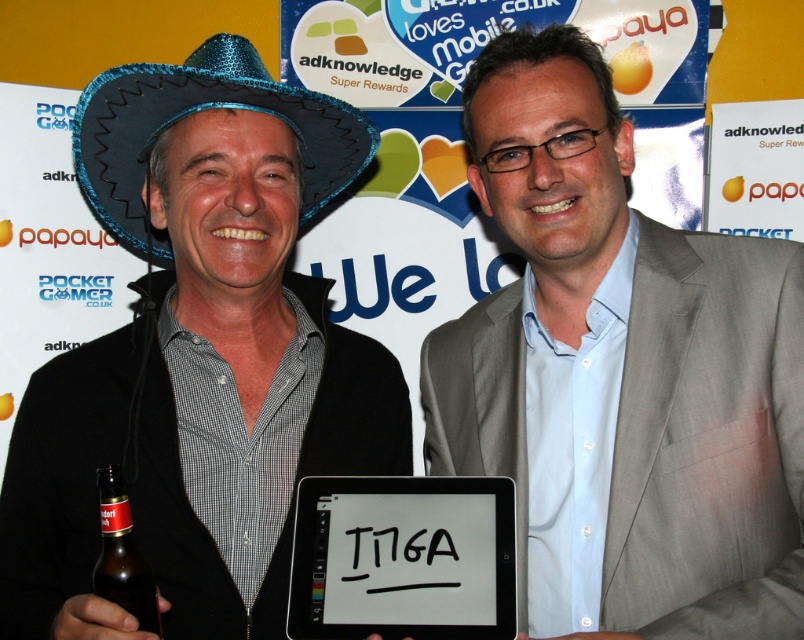
Question: Can you confirm if light gray suit at center is positioned to the right of black matte tablet at center?

Choices:
 (A) yes
 (B) no

Answer: (A)

Question: Which of these objects is positioned farthest from the glittery blue sombrero at left?

Choices:
 (A) light gray suit at center
 (B) shiny blue hat at center
 (C) brown glass bottle at lower left

Answer: (C)

Question: Is black matte tablet at center bigger than brown glass bottle at lower left?

Choices:
 (A) yes
 (B) no

Answer: (A)

Question: Which point is farther to the camera?

Choices:
 (A) glittery blue sombrero at left
 (B) light gray suit at center
 (C) brown glass bottle at lower left
 (D) black matte tablet at center

Answer: (A)

Question: Does shiny blue hat at center appear over glittery blue sombrero at left?

Choices:
 (A) no
 (B) yes

Answer: (A)

Question: Which point appears farthest from the camera in this image?

Choices:
 (A) (163, 324)
 (B) (124, 520)

Answer: (A)